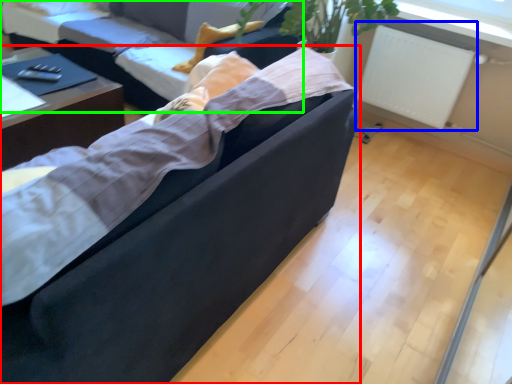
Question: Which object is the closest to the studio couch (highlighted by a red box)? Choose among these: radiator (highlighted by a blue box) or studio couch (highlighted by a green box).

Choices:
 (A) radiator
 (B) studio couch

Answer: (B)